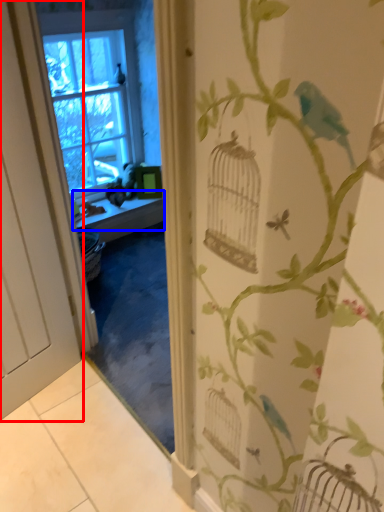
Question: Which object is further to the camera taking this photo, door (highlighted by a red box) or window sill (highlighted by a blue box)?

Choices:
 (A) door
 (B) window sill

Answer: (B)